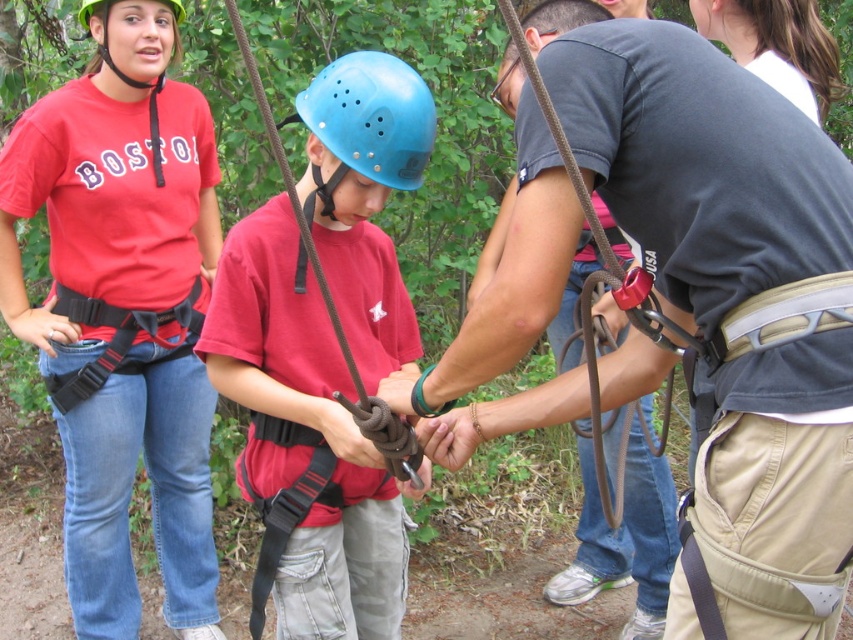
Question: Which of the following is the farthest from the observer?

Choices:
 (A) (376, 102)
 (B) (155, 224)
 (C) (335, 136)
 (D) (805, 157)

Answer: (B)

Question: Which of the following is the closest to the observer?

Choices:
 (A) (114, 448)
 (B) (170, 4)
 (C) (381, 67)

Answer: (C)

Question: Is dark gray fabric belt at center closer to the viewer compared to blue matte helmet at center?

Choices:
 (A) no
 (B) yes

Answer: (A)

Question: Is the position of matte red shirt at center more distant than that of blue matte helmet at center?

Choices:
 (A) no
 (B) yes

Answer: (B)

Question: Can you confirm if matte red shirt at center is positioned to the right of dark gray fabric belt at center?

Choices:
 (A) yes
 (B) no

Answer: (B)

Question: Which object is closer to the camera taking this photo?

Choices:
 (A) blue matte helmet at center
 (B) matte green helmet at upper left

Answer: (A)